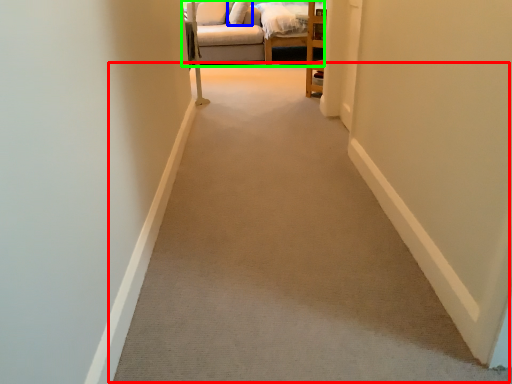
Question: Which object is the farthest from path (highlighted by a red box)? Choose among these: pillow (highlighted by a blue box) or studio couch (highlighted by a green box).

Choices:
 (A) pillow
 (B) studio couch

Answer: (A)